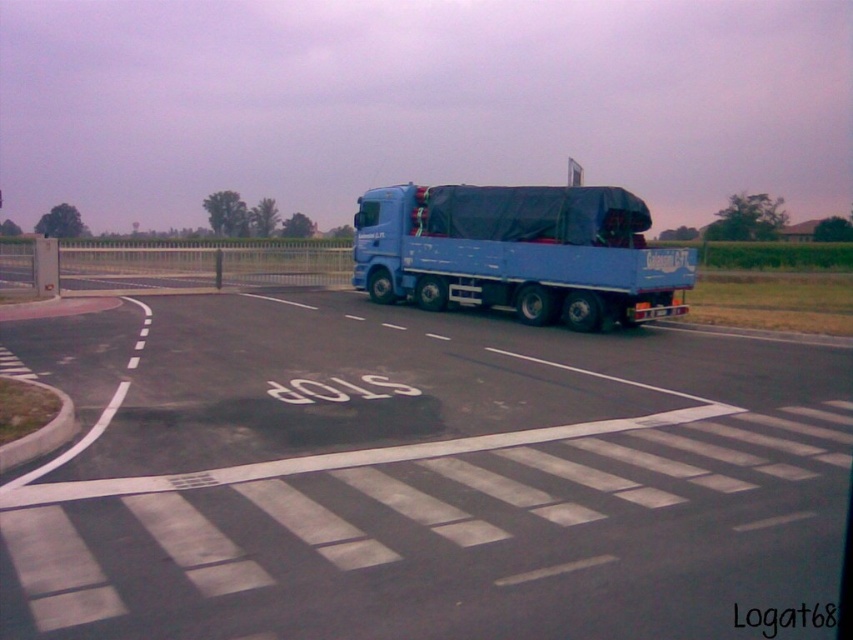
Which is below, blue rubber truck at center or blue matte trailer truck at center?

blue rubber truck at center is below.

Between blue rubber truck at center and blue matte trailer truck at center, which one is positioned higher?

blue matte trailer truck at center

Is point (248, 483) positioned after point (595, 292)?

No, it is in front of (595, 292).

Identify the location of blue rubber truck at center. This screenshot has height=640, width=853. (421, 476).